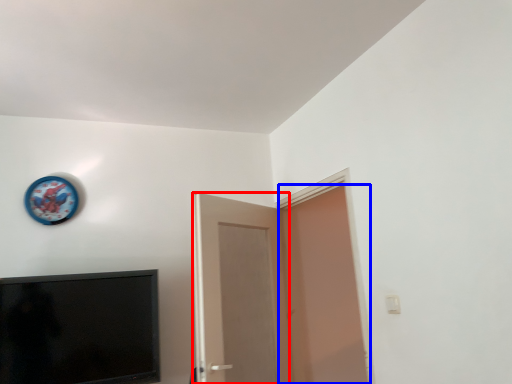
Question: Which of the following is the farthest to the observer, door (highlighted by a red box) or door (highlighted by a blue box)?

Choices:
 (A) door
 (B) door

Answer: (A)